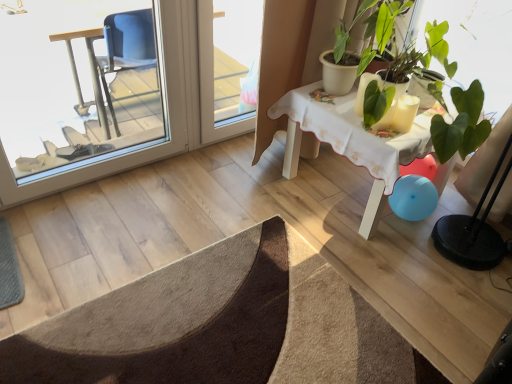
The width and height of the screenshot is (512, 384). I want to click on empty space that is ontop of brown textured doormat at lower left (from a real-world perspective), so click(154, 321).